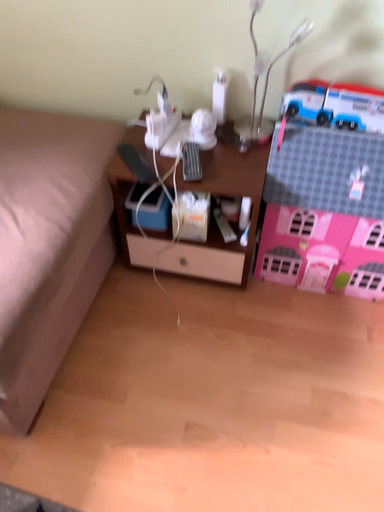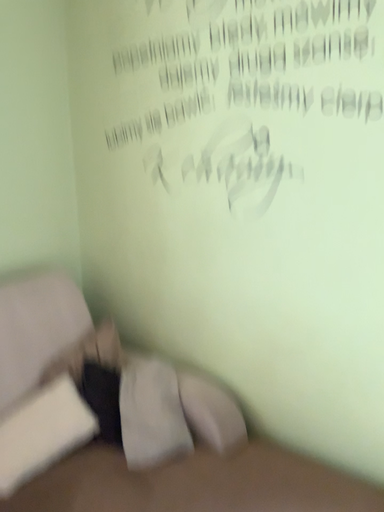
Question: Which way did the camera rotate in the video?

Choices:
 (A) rotated downward
 (B) rotated upward

Answer: (B)